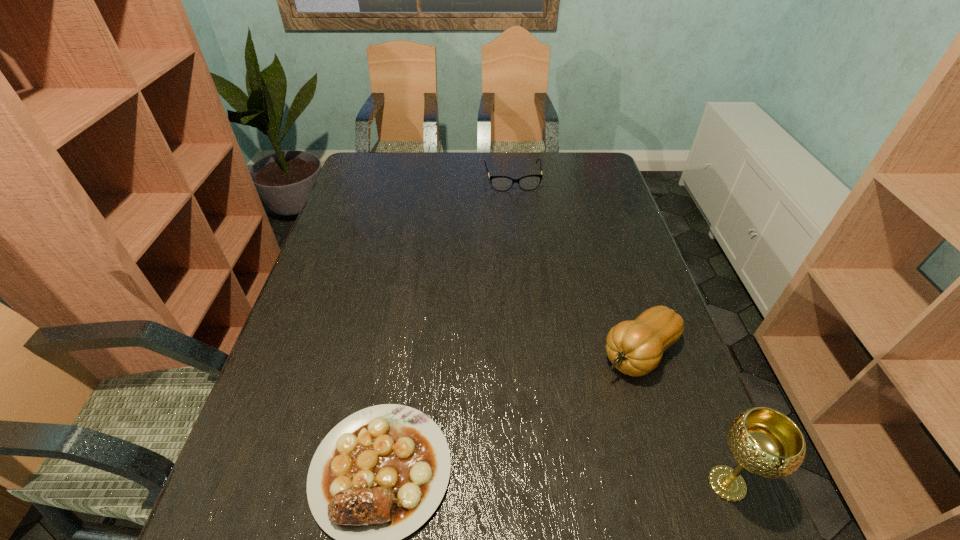
This screenshot has width=960, height=540. Identify the location of free space that satisfies the following two spatial constraints: 1. on the front side of the farthest object; 2. on the right side of the tallest object. (541, 483).